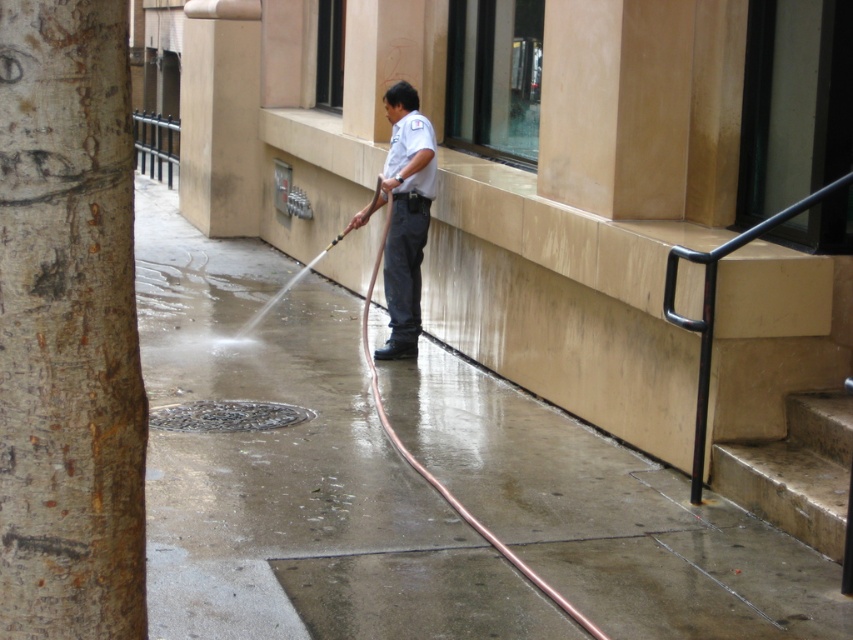
Between point (788, 451) and point (392, 291), which one is positioned behind?

Point (392, 291)

Who is more forward, [799,412] or [398,330]?

Positioned in front is point [799,412].

Is point (795, 531) more distant than point (387, 100)?

No, it is not.

At what (x,y) coordinates should I click in order to perform the action: click on concrete stairs at lower right. Please return your answer as a coordinate pair (x, y). This screenshot has height=640, width=853. Looking at the image, I should click on (795, 472).

Who is shorter, smooth bark tree trunk at left or concrete stairs at lower right?

concrete stairs at lower right

Who is positioned more to the left, smooth bark tree trunk at left or concrete stairs at lower right?

Positioned to the left is smooth bark tree trunk at left.

Image resolution: width=853 pixels, height=640 pixels. What do you see at coordinates (68, 326) in the screenshot? I see `smooth bark tree trunk at left` at bounding box center [68, 326].

Locate an element on the screen. smooth bark tree trunk at left is located at coordinates (68, 326).

Looking at this image, who is shorter, smooth bark tree trunk at left or white uniform at center?

smooth bark tree trunk at left

Does point (7, 166) come closer to viewer compared to point (396, 250)?

Yes, it is.

Between point (76, 339) and point (427, 166), which one is positioned in front?

Point (76, 339) is more forward.

Where is `smooth bark tree trunk at left`? The height and width of the screenshot is (640, 853). smooth bark tree trunk at left is located at coordinates (68, 326).